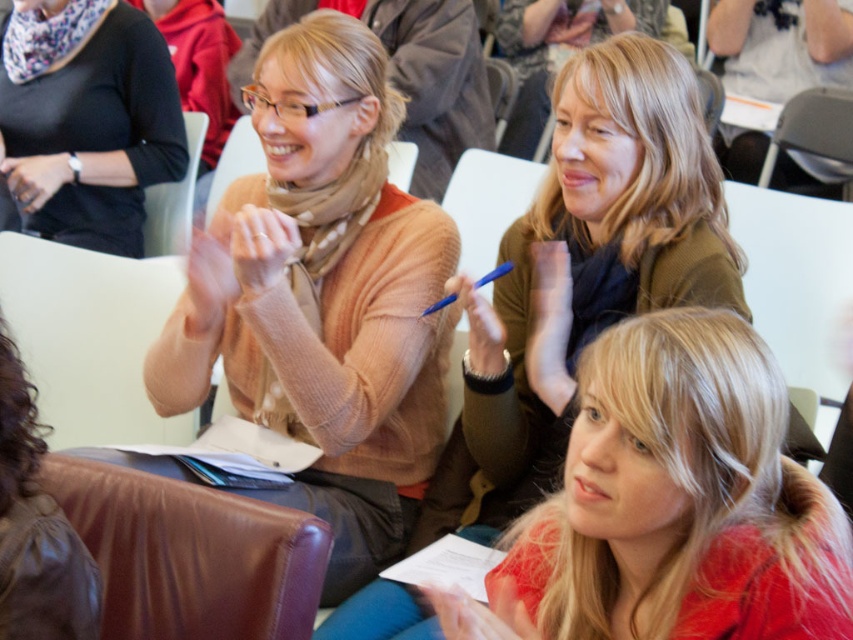
You are organizing a photo shoot and need to ensure that the shiny red coat at center and the matte brown sweater at center are positioned precisely for a closeup shot. What is the minimum distance you should maintain between these two items to ensure they are both in frame without overlapping?

The minimum distance you should maintain between the shiny red coat at center and the matte brown sweater at center is 18.88 inches to ensure they are both in frame without overlapping.